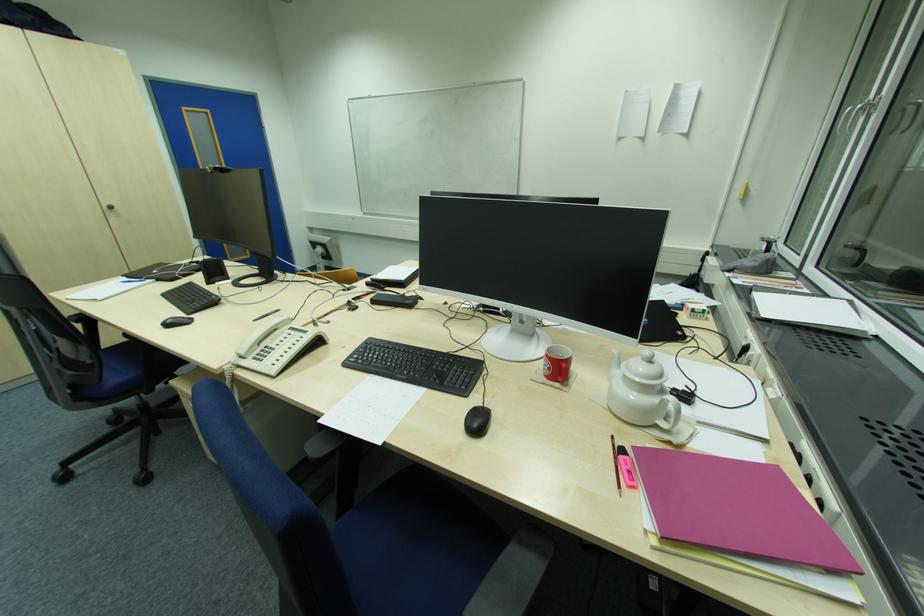
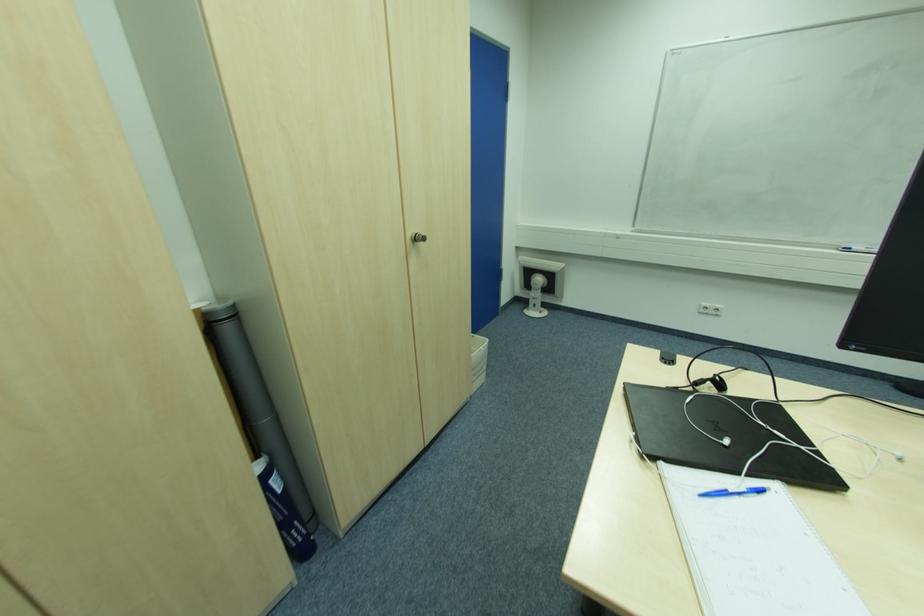
Locate, in the second image, the point that corresponds to [113,209] in the first image.

(419, 240)